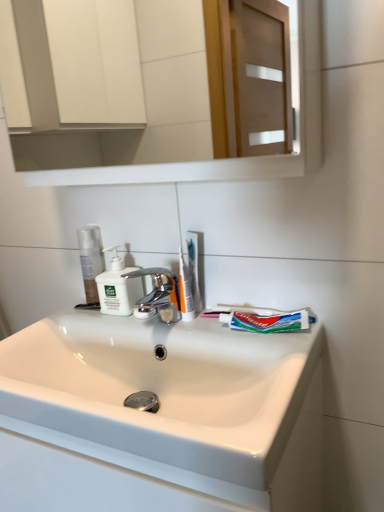
You are a GUI agent. You are given a task and a screenshot of the screen. Output one action in this format:
    pyautogui.click(x=<x>, y=<y>)
    Task: Click on the vacant area in front of clear plastic bottle at left
    
    Given the screenshot: What is the action you would take?
    pyautogui.click(x=82, y=323)